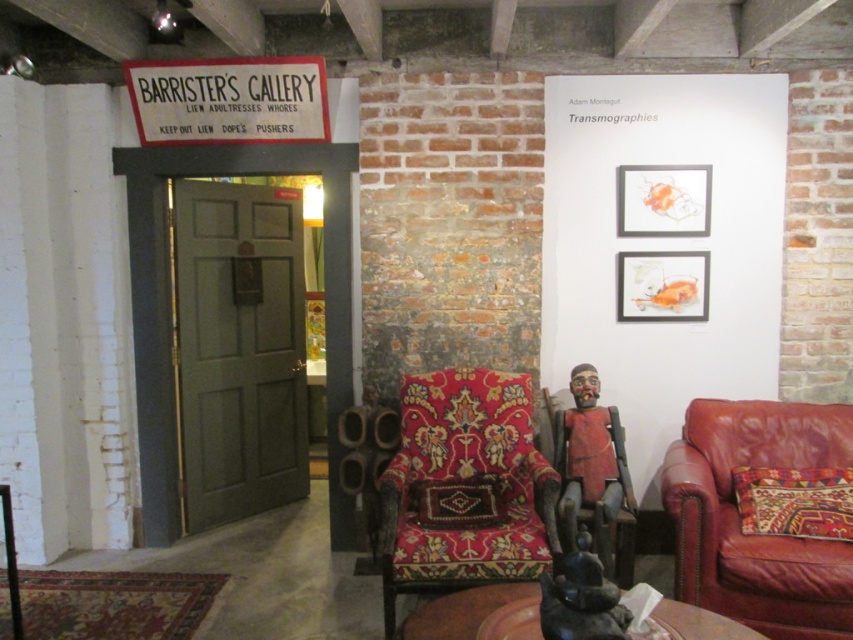
Is wooden armchair at center below matte orange painting at upper right?

Yes, wooden armchair at center is below matte orange painting at upper right.

Is point (554, 436) positioned after point (685, 272)?

No, (554, 436) is in front of (685, 272).

The image size is (853, 640). I want to click on wooden armchair at center, so click(x=596, y=493).

Between leather armchair at right and matte orange painting at upper right, which one is positioned lower?

leather armchair at right is below.

What do you see at coordinates (740, 522) in the screenshot? I see `leather armchair at right` at bounding box center [740, 522].

Between point (791, 548) and point (685, 268), which one is positioned behind?

Positioned behind is point (685, 268).

At what (x,y) coordinates should I click in order to perform the action: click on leather armchair at right. Please return your answer as a coordinate pair (x, y). Looking at the image, I should click on (740, 522).

Does point (653, 196) lie in front of point (625, 316)?

Yes, point (653, 196) is closer to viewer.

Who is more forward, (654, 196) or (676, 321)?

Point (654, 196) is more forward.

Identify the location of matte silver picture frame at upper right. The height and width of the screenshot is (640, 853). (663, 200).